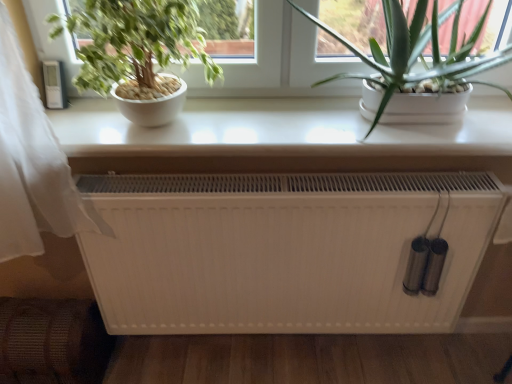
Where is `empty space that is ontop of white glossy table at upper center (from a real-world perspective)`? This screenshot has width=512, height=384. empty space that is ontop of white glossy table at upper center (from a real-world perspective) is located at coordinates (264, 123).